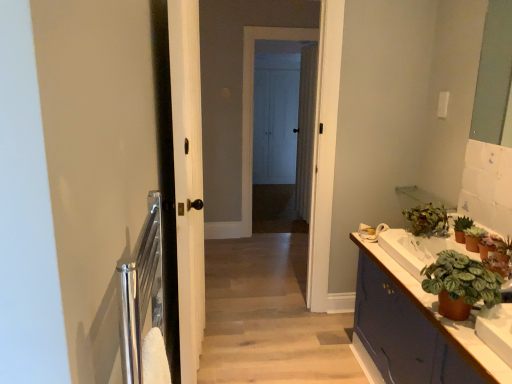
Where is `green matte plant at right, placed as the second houseplant when sorted from back to front`? The image size is (512, 384). green matte plant at right, placed as the second houseplant when sorted from back to front is located at coordinates (461, 228).

Find the location of a particular element. This screenshot has width=512, height=384. white wood screen door at center, which is counted as the 1th screen door, starting from the front is located at coordinates (283, 126).

Consider the image. Measure the distance between white glossy sink at right and camera.

A distance of 1.40 meters exists between white glossy sink at right and camera.

Locate an element on the screen. white wood screen door at center, the first screen door from the back is located at coordinates (275, 125).

From the picture: Is green matte plant at right, placed as the second houseplant when sorted from back to front, inside the boundaries of white textured curtain at center, or outside?

green matte plant at right, placed as the second houseplant when sorted from back to front, is spatially situated outside white textured curtain at center.

From a real-world perspective, is green matte plant at right, placed as the second houseplant when sorted from back to front, physically located above or below white textured curtain at center?

green matte plant at right, placed as the second houseplant when sorted from back to front, is below white textured curtain at center.

From the image's perspective, is green matte plant at right, arranged as the 4th houseplant when viewed from the front, over white textured curtain at center?

No, from the image's perspective, green matte plant at right, arranged as the 4th houseplant when viewed from the front, is not over white textured curtain at center.

Can you confirm if green matte plant at right, placed as the second houseplant when sorted from back to front, is wider than white textured curtain at center?

Indeed, green matte plant at right, placed as the second houseplant when sorted from back to front, has a greater width compared to white textured curtain at center.

What's the angular difference between green matte plant at upper right, which ranks as the 5th houseplant in front-to-back order, and matte purple cabinet at right's facing directions?

1.62 degrees.

Between green matte plant at upper right, which ranks as the 5th houseplant in front-to-back order, and matte purple cabinet at right, which one has more height?

matte purple cabinet at right.

Does green matte plant at upper right, the first houseplant positioned from the back, contain matte purple cabinet at right?

No.

Is green matte plant at upper right, the first houseplant positioned from the back, smaller than matte purple cabinet at right?

Indeed, green matte plant at upper right, the first houseplant positioned from the back, has a smaller size compared to matte purple cabinet at right.

Between matte purple cabinet at right and white wood door at center, which one has smaller size?

With smaller size is white wood door at center.

Is point (367, 287) closer to camera compared to point (183, 310)?

No.

From a real-world perspective, is matte purple cabinet at right below white wood door at center?

Indeed, from a real-world perspective, matte purple cabinet at right is positioned beneath white wood door at center.

From the picture: Is matte purple cabinet at right in front of or behind white wood door at center in the image?

matte purple cabinet at right is in front of white wood door at center.

Considering the positions of point (419, 208) and point (312, 180), is point (419, 208) closer or farther from the camera than point (312, 180)?

Point (419, 208) is positioned closer to the camera compared to point (312, 180).

Can you confirm if green matte plant at upper right, which ranks as the 5th houseplant in front-to-back order, is smaller than white textured curtain at center?

Correct, green matte plant at upper right, which ranks as the 5th houseplant in front-to-back order, occupies less space than white textured curtain at center.

Looking at this image, from the image's perspective, which one is positioned lower, green matte plant at upper right, the first houseplant positioned from the back, or white textured curtain at center?

From the image's view, green matte plant at upper right, the first houseplant positioned from the back, is below.

Which object is wider, green matte plant at upper right, the first houseplant positioned from the back, or white textured curtain at center?

green matte plant at upper right, the first houseplant positioned from the back.

From the image's perspective, which one is positioned lower, white wood door at center or green matte plant at upper right, which ranks as the 5th houseplant in front-to-back order?

green matte plant at upper right, which ranks as the 5th houseplant in front-to-back order, from the image's perspective.

Considering their positions, is white wood door at center located in front of or behind green matte plant at upper right, the first houseplant positioned from the back?

In the image, white wood door at center appears in front of green matte plant at upper right, the first houseplant positioned from the back.

Is white wood door at center wider than green matte plant at upper right, the first houseplant positioned from the back?

Incorrect, the width of white wood door at center does not surpass that of green matte plant at upper right, the first houseplant positioned from the back.

Locate an element on the screen. The image size is (512, 384). door located on the left of green matte plant at upper right, which ranks as the 5th houseplant in front-to-back order is located at coordinates (188, 179).

Is matte purple cabinet at right to the left or to the right of white glossy sink at right in the image?

From the image, it's evident that matte purple cabinet at right is to the left of white glossy sink at right.

From the image's perspective, which object appears higher, matte purple cabinet at right or white glossy sink at right?

white glossy sink at right appears higher in the image.

Which is closer to the camera, [454,338] or [480,280]?

Positioned in front is point [480,280].

Consider the image. Would you say matte purple cabinet at right is outside white glossy sink at right?

That's correct, matte purple cabinet at right is outside of white glossy sink at right.

Which is correct: matte purple cabinet at right is inside green matte plant at right, acting as the 3th houseplant starting from the front, or outside of it?

A: matte purple cabinet at right is not enclosed by green matte plant at right, acting as the 3th houseplant starting from the front.

Between matte purple cabinet at right and green matte plant at right, acting as the 3th houseplant starting from the front, which one appears on the left side from the viewer's perspective?

matte purple cabinet at right is more to the left.

From a real-world perspective, who is located lower, matte purple cabinet at right or green matte plant at right, acting as the 3th houseplant starting from the front?

matte purple cabinet at right, from a real-world perspective.

Identify the location of curtain located on the left of green matte plant at right, placed as the second houseplant when sorted from back to front. This screenshot has height=384, width=512. (306, 130).

Where is `houseplant that is the 5th object located behind the matte purple cabinet at right`? houseplant that is the 5th object located behind the matte purple cabinet at right is located at coordinates (426, 220).

From the picture: When comparing their distances from matte purple cabinet at right, does green matte plant at right, the 2th houseplant when ordered from front to back, or green matte plant at right, acting as the 3th houseplant starting from the front, seem closer?

Based on the image, green matte plant at right, the 2th houseplant when ordered from front to back, appears to be nearer to matte purple cabinet at right.

Looking at the image, which one is located closer to white glossy sink at right, white textured curtain at center or matte purple cabinet at right?

Based on the image, matte purple cabinet at right appears to be nearer to white glossy sink at right.

Based on their spatial positions, is green matte plant at right, acting as the 5th houseplant starting from the back, or white glossy sink at right closer to green matte plant at right, arranged as the 4th houseplant when viewed from the front?

A: The object closer to green matte plant at right, arranged as the 4th houseplant when viewed from the front, is white glossy sink at right.

Estimate the real-world distances between objects in this image. Which object is further from white glossy sink at right, matte purple cabinet at right or green matte plant at upper right, the first houseplant positioned from the back?

matte purple cabinet at right is further to white glossy sink at right.

Estimate the real-world distances between objects in this image. Which object is further from white wood door at center, white wood screen door at center, which appears as the 2th screen door when viewed from the front, or matte purple cabinet at right?

white wood screen door at center, which appears as the 2th screen door when viewed from the front.

Based on their spatial positions, is white textured curtain at center or matte purple cabinet at right further from green matte plant at right, placed as the second houseplant when sorted from back to front?

white textured curtain at center.

From the image, which object appears to be nearer to white wood door at center, green matte plant at right, placed as the second houseplant when sorted from back to front, or white wood screen door at center, which appears as the 2th screen door when viewed from the front?

green matte plant at right, placed as the second houseplant when sorted from back to front, lies closer to white wood door at center than the other object.

From the image, which object appears to be farther from green matte plant at right, arranged as the 1th houseplant when viewed from the front, green matte plant at upper right, which ranks as the 5th houseplant in front-to-back order, or white wood screen door at center, the first screen door from the back?

Based on the image, white wood screen door at center, the first screen door from the back, appears to be further to green matte plant at right, arranged as the 1th houseplant when viewed from the front.

Image resolution: width=512 pixels, height=384 pixels. In order to click on houseplant positioned between green matte plant at right, placed as the second houseplant when sorted from back to front, and white wood screen door at center, which is counted as the 1th screen door, starting from the front, from near to far in this screenshot , I will do `click(426, 220)`.

Locate an element on the screen. This screenshot has height=384, width=512. curtain located between matte purple cabinet at right and white wood screen door at center, which appears as the 2th screen door when viewed from the front, in the depth direction is located at coordinates (306, 130).

Image resolution: width=512 pixels, height=384 pixels. Find the location of `houseplant between green matte plant at right, arranged as the 1th houseplant when viewed from the front, and green matte plant at right, acting as the 3th houseplant starting from the front, along the z-axis`. houseplant between green matte plant at right, arranged as the 1th houseplant when viewed from the front, and green matte plant at right, acting as the 3th houseplant starting from the front, along the z-axis is located at coordinates (495, 247).

Locate an element on the screen. screen door located between matte purple cabinet at right and white textured curtain at center in the depth direction is located at coordinates (283, 126).